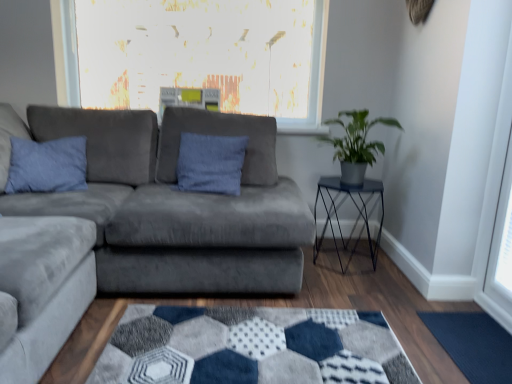
Question: From a real-world perspective, is green matte plant at right positioned over suede gray couch at center based on gravity?

Choices:
 (A) yes
 (B) no

Answer: (A)

Question: Does green matte plant at right have a greater height compared to suede gray couch at center?

Choices:
 (A) no
 (B) yes

Answer: (A)

Question: Can you confirm if green matte plant at right is positioned to the left of suede gray couch at center?

Choices:
 (A) no
 (B) yes

Answer: (A)

Question: Considering the relative sizes of green matte plant at right and suede gray couch at center in the image provided, is green matte plant at right wider than suede gray couch at center?

Choices:
 (A) no
 (B) yes

Answer: (A)

Question: Is green matte plant at right aimed at suede gray couch at center?

Choices:
 (A) no
 (B) yes

Answer: (A)

Question: Considering the relative sizes of green matte plant at right and suede gray couch at center in the image provided, is green matte plant at right thinner than suede gray couch at center?

Choices:
 (A) no
 (B) yes

Answer: (B)

Question: Would you consider metallic black table at right to be distant from blue suede pillow at left?

Choices:
 (A) yes
 (B) no

Answer: (A)

Question: From the image's perspective, is metallic black table at right located beneath blue suede pillow at left?

Choices:
 (A) no
 (B) yes

Answer: (B)

Question: Does metallic black table at right come in front of blue suede pillow at left?

Choices:
 (A) yes
 (B) no

Answer: (B)

Question: From a real-world perspective, is metallic black table at right located higher than blue suede pillow at left?

Choices:
 (A) yes
 (B) no

Answer: (B)

Question: Is metallic black table at right shorter than blue suede pillow at left?

Choices:
 (A) no
 (B) yes

Answer: (A)

Question: Is metallic black table at right positioned with its back to blue suede pillow at left?

Choices:
 (A) no
 (B) yes

Answer: (A)

Question: Could you tell me if dark blue textured mat at lower right is facing suede gray couch at center?

Choices:
 (A) no
 (B) yes

Answer: (A)